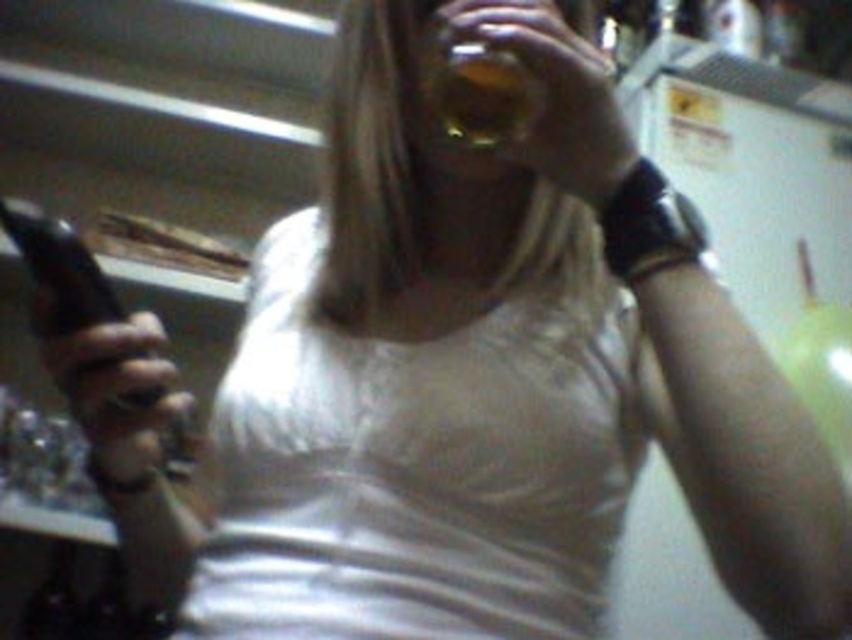
Describe the element at coordinates (421, 458) in the screenshot. This screenshot has height=640, width=852. I see `white matte tank top at center` at that location.

Between white matte tank top at center and translucent amber liquid at upper center, which one is positioned higher?

translucent amber liquid at upper center is above.

You are a GUI agent. You are given a task and a screenshot of the screen. Output one action in this format:
    pyautogui.click(x=<x>, y=<y>)
    Task: Click on the white matte tank top at center
    The image size is (852, 640).
    Given the screenshot: What is the action you would take?
    pyautogui.click(x=421, y=458)

This screenshot has width=852, height=640. What are the coordinates of `white matte tank top at center` in the screenshot? It's located at (421, 458).